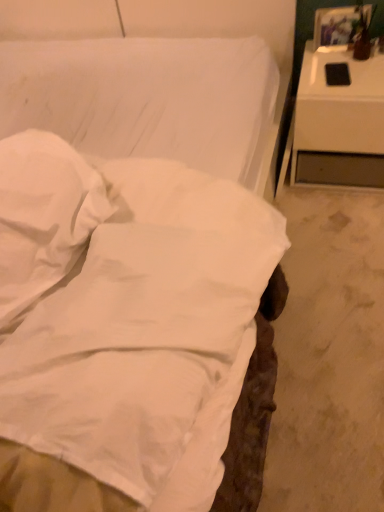
Question: Considering the relative positions of white glossy nightstand at right and matte brown vase at upper right in the image provided, is white glossy nightstand at right to the left or to the right of matte brown vase at upper right?

Choices:
 (A) left
 (B) right

Answer: (A)

Question: Considering the positions of point (301, 101) and point (352, 54), is point (301, 101) closer or farther from the camera than point (352, 54)?

Choices:
 (A) closer
 (B) farther

Answer: (A)

Question: Estimate the real-world distances between objects in this image. Which object is closer to the matte brown vase at upper right?

Choices:
 (A) white glossy nightstand at right
 (B) white soft pillow at center

Answer: (A)

Question: Which object is positioned farthest from the matte brown vase at upper right?

Choices:
 (A) white glossy nightstand at right
 (B) white soft pillow at center

Answer: (B)